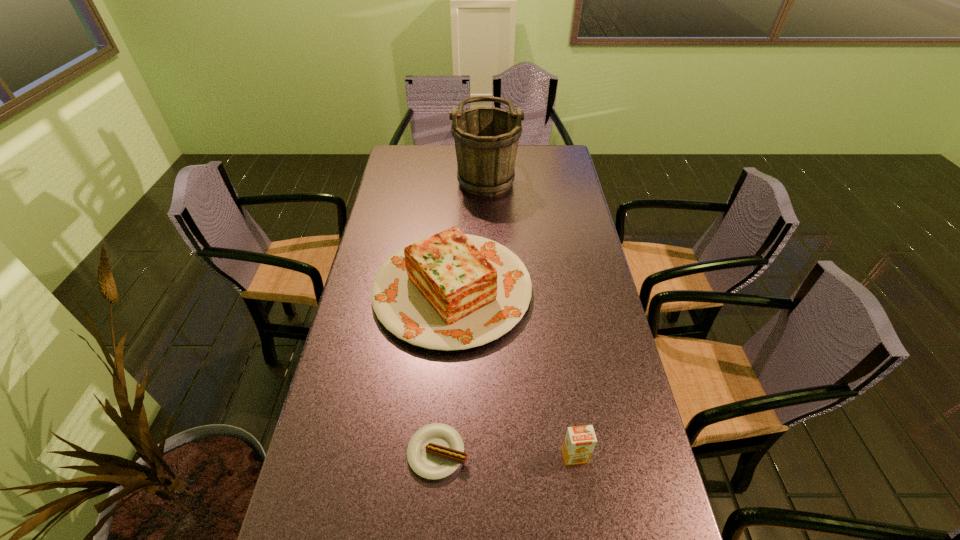
Image resolution: width=960 pixels, height=540 pixels. I want to click on free space between the shortest object and the orange juice, so point(506,454).

The height and width of the screenshot is (540, 960). Find the location of `vacant point located between the sausage and the third shortest object`. vacant point located between the sausage and the third shortest object is located at coordinates (444, 372).

Locate an element on the screen. The image size is (960, 540). vacant point located between the bucket and the lasagna is located at coordinates (469, 232).

I want to click on vacant area that lies between the lasagna and the shortest object, so click(x=444, y=372).

You are a GUI agent. You are given a task and a screenshot of the screen. Output one action in this format:
    pyautogui.click(x=<x>, y=<y>)
    Task: Click on the free spot between the lasagna and the sausage
    The image size is (960, 540).
    Given the screenshot: What is the action you would take?
    pyautogui.click(x=444, y=372)

Locate an element on the screen. This screenshot has width=960, height=540. vacant region between the sausage and the third shortest object is located at coordinates (444, 372).

You are a GUI agent. You are given a task and a screenshot of the screen. Output one action in this format:
    pyautogui.click(x=<x>, y=<y>)
    Task: Click on the vacant space in between the third tallest object and the bucket
    Image resolution: width=960 pixels, height=540 pixels.
    Given the screenshot: What is the action you would take?
    pyautogui.click(x=530, y=315)

The height and width of the screenshot is (540, 960). In order to click on empty space between the tallest object and the third tallest object in this screenshot , I will do `click(530, 315)`.

Identify the location of unoccupied area between the orange juice and the tallest object. This screenshot has width=960, height=540. coord(530,315).

Select which object is the closest to the tallest object. Please provide its 2D coordinates. Your answer should be formatted as a tuple, i.e. [(x, y)], where the tuple contains the x and y coordinates of a point satisfying the conditions above.

[(451, 291)]